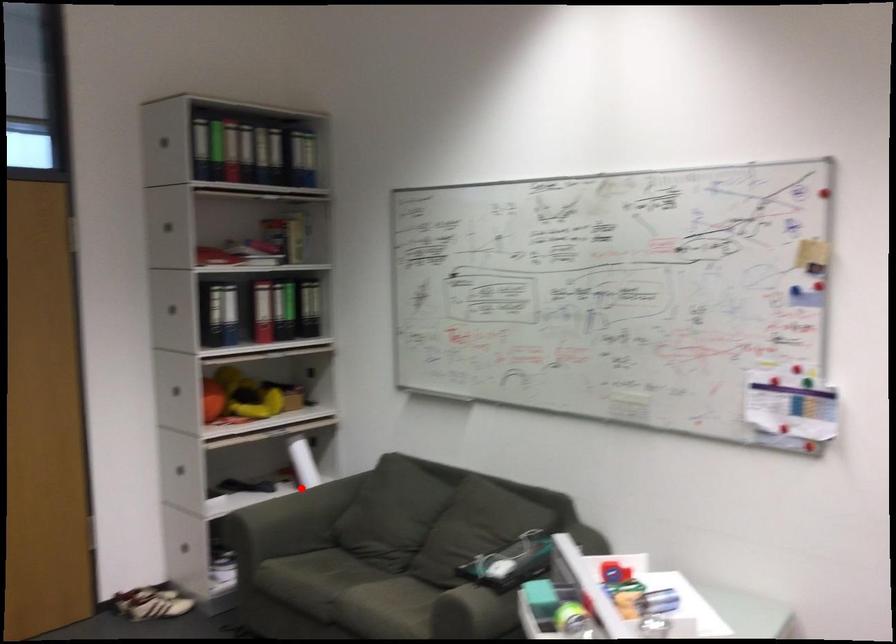
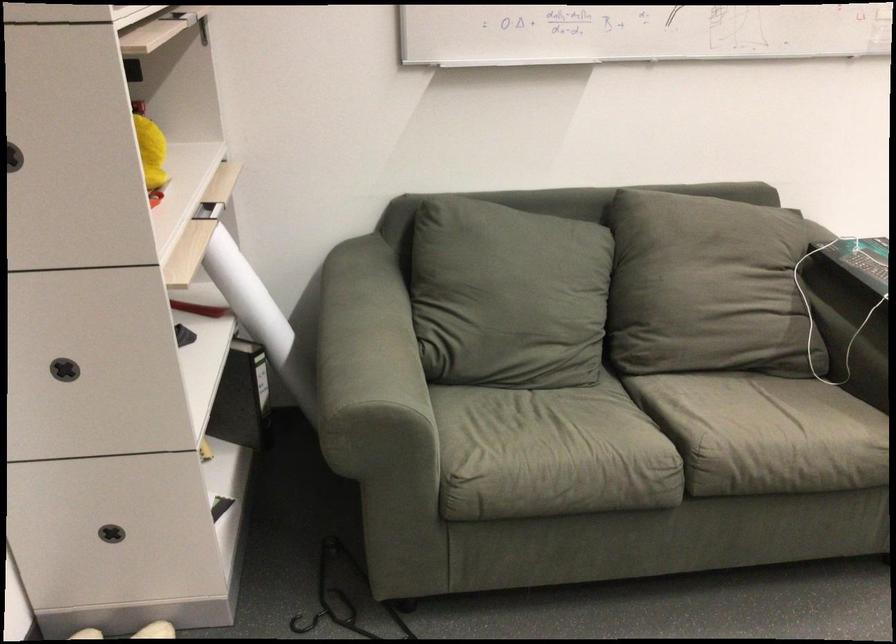
In the second image, find the point that corresponds to the highlighted location in the first image.

(247, 296)